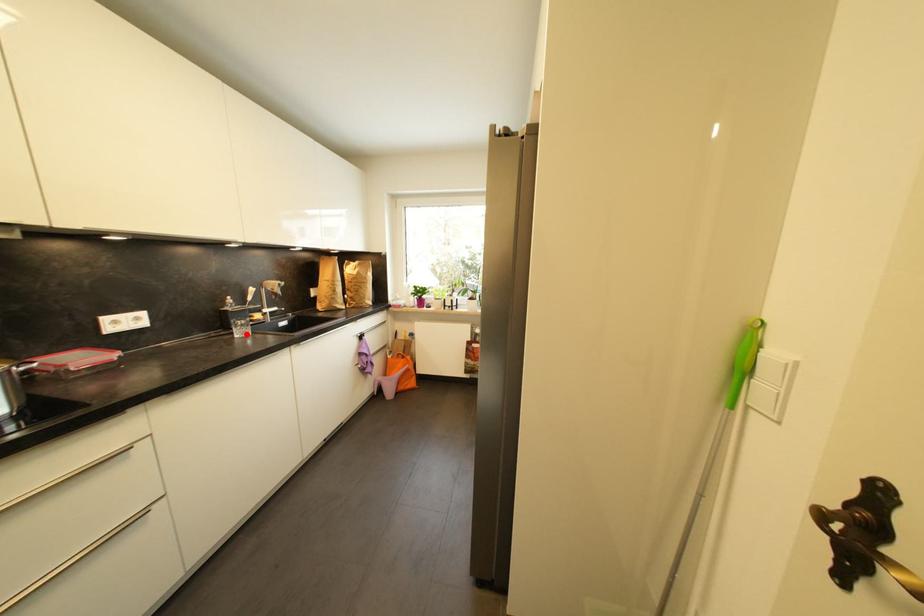
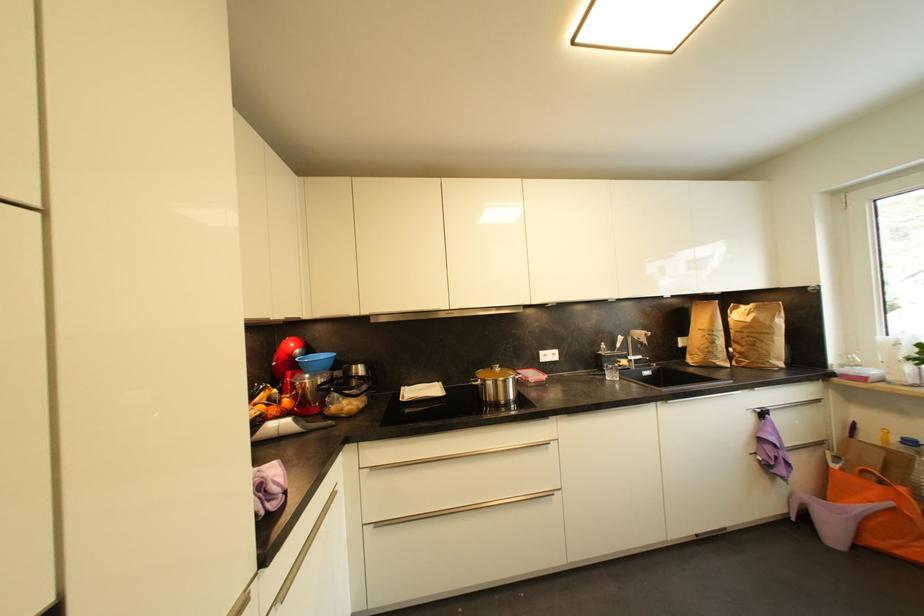
Where in the second image is the point corresponding to the highlighted location from the first image?

(616, 378)